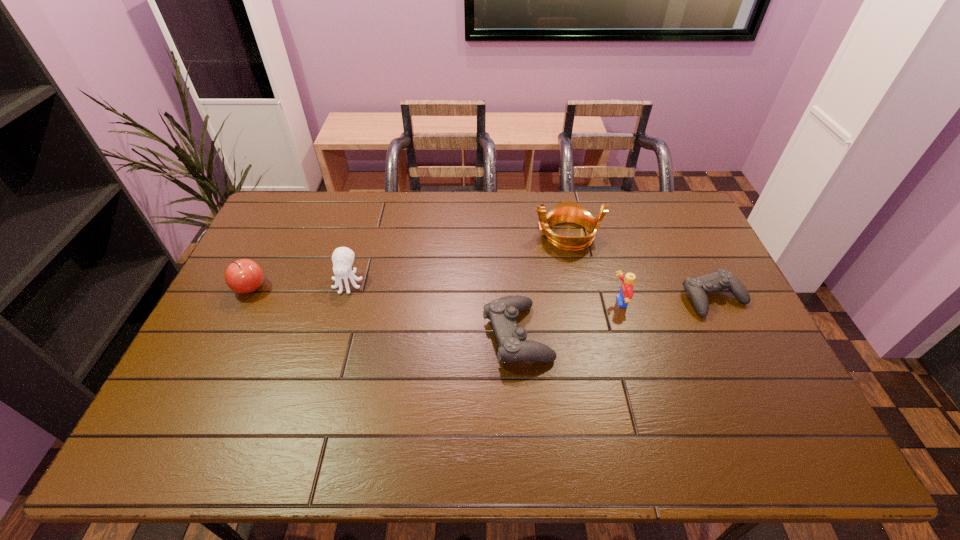
The height and width of the screenshot is (540, 960). I want to click on vacant space located at the front emblem of the farthest object, so click(488, 235).

The height and width of the screenshot is (540, 960). What are the coordinates of `vacant region located 0.140m at the front emblem of the farthest object` in the screenshot? It's located at (493, 235).

Find the location of a particular element. vacant space located 0.180m at the front emblem of the farthest object is located at coordinates (482, 235).

This screenshot has height=540, width=960. Identify the location of vacant space located 0.230m on the front-facing side of the octopus. [326, 359].

The height and width of the screenshot is (540, 960). What are the coordinates of `free space located 0.140m on the face of the Lego` in the screenshot? It's located at (564, 303).

You are a GUI agent. You are given a task and a screenshot of the screen. Output one action in this format:
    pyautogui.click(x=<x>, y=<y>)
    Task: Click on the free region located on the face of the Lego
    The height and width of the screenshot is (540, 960).
    Given the screenshot: What is the action you would take?
    pyautogui.click(x=527, y=303)

Locate an element on the screen. The height and width of the screenshot is (540, 960). vacant area situated on the face of the Lego is located at coordinates (547, 303).

Find the location of `vacant point located 0.290m on the right of the apple`. vacant point located 0.290m on the right of the apple is located at coordinates (361, 287).

Locate an element on the screen. object located at the far edge is located at coordinates (567, 211).

Locate an element on the screen. object that is at the left edge is located at coordinates (243, 276).